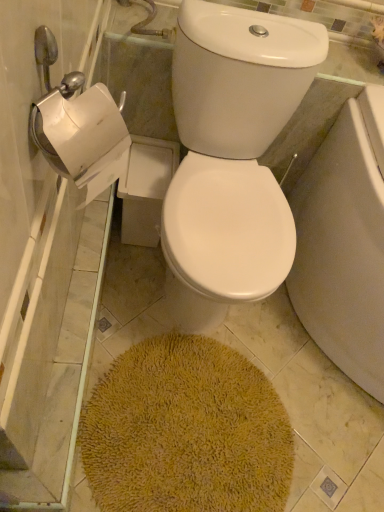
Describe the element at coordinates (186, 431) in the screenshot. I see `yellow shaggy bath mat at center` at that location.

I want to click on yellow shaggy bath mat at center, so click(x=186, y=431).

Find the location of a particular element. This screenshot has height=512, width=384. white glossy toilet bowl at center is located at coordinates (231, 156).

Image resolution: width=384 pixels, height=512 pixels. What do you see at coordinates (231, 156) in the screenshot?
I see `white glossy toilet bowl at center` at bounding box center [231, 156].

At what (x,y) coordinates should I click in order to perform the action: click on yellow shaggy bath mat at center. Please return your answer as a coordinate pair (x, y). The width and height of the screenshot is (384, 512). Looking at the image, I should click on (186, 431).

Based on their positions, is white glossy toilet bowl at center located to the left or right of yellow shaggy bath mat at center?

white glossy toilet bowl at center is to the right of yellow shaggy bath mat at center.

In the image, is white glossy toilet bowl at center positioned in front of or behind yellow shaggy bath mat at center?

In the image, white glossy toilet bowl at center appears in front of yellow shaggy bath mat at center.

Between point (238, 236) and point (116, 384), which one is positioned in front?

The point (238, 236) is closer to the camera.

From the image's perspective, which one is positioned higher, white glossy toilet bowl at center or yellow shaggy bath mat at center?

white glossy toilet bowl at center, from the image's perspective.

From a real-world perspective, which object stands above the other?

white glossy toilet bowl at center.

Looking at this image, can you confirm if white glossy toilet bowl at center is wider than yellow shaggy bath mat at center?

Yes.

Who is shorter, white glossy toilet bowl at center or yellow shaggy bath mat at center?

yellow shaggy bath mat at center.

Based on their sizes in the image, would you say white glossy toilet bowl at center is bigger or smaller than yellow shaggy bath mat at center?

Considering their sizes, white glossy toilet bowl at center takes up more space than yellow shaggy bath mat at center.

Is white glossy toilet bowl at center spatially inside yellow shaggy bath mat at center, or outside of it?

white glossy toilet bowl at center is spatially situated outside yellow shaggy bath mat at center.

Based on the photo, is white glossy toilet bowl at center not close to yellow shaggy bath mat at center?

No, white glossy toilet bowl at center is in close proximity to yellow shaggy bath mat at center.

Is white glossy toilet bowl at center facing towards yellow shaggy bath mat at center?

Yes, white glossy toilet bowl at center is facing yellow shaggy bath mat at center.

Can you tell me how much white glossy toilet bowl at center and yellow shaggy bath mat at center differ in facing direction?

The angular difference between white glossy toilet bowl at center and yellow shaggy bath mat at center is 0.000102 degrees.

Locate an element on the screen. The height and width of the screenshot is (512, 384). toilet bowl in front of the yellow shaggy bath mat at center is located at coordinates (231, 156).

Which object is positioned more to the right, yellow shaggy bath mat at center or white glossy toilet bowl at center?

white glossy toilet bowl at center.

Considering their positions, is yellow shaggy bath mat at center located in front of or behind white glossy toilet bowl at center?

In the image, yellow shaggy bath mat at center appears behind white glossy toilet bowl at center.

Is point (261, 499) closer or farther from the camera than point (271, 174)?

Clearly, point (261, 499) is closer to the camera than point (271, 174).

From the image's perspective, which one is positioned higher, yellow shaggy bath mat at center or white glossy toilet bowl at center?

white glossy toilet bowl at center, from the image's perspective.

From a real-world perspective, is yellow shaggy bath mat at center physically located above or below white glossy toilet bowl at center?

yellow shaggy bath mat at center is situated lower than white glossy toilet bowl at center in the real world.

From the picture: Can you confirm if yellow shaggy bath mat at center is thinner than white glossy toilet bowl at center?

Correct, the width of yellow shaggy bath mat at center is less than that of white glossy toilet bowl at center.

Based on the photo, is yellow shaggy bath mat at center taller or shorter than white glossy toilet bowl at center?

yellow shaggy bath mat at center is shorter than white glossy toilet bowl at center.

Who is bigger, yellow shaggy bath mat at center or white glossy toilet bowl at center?

white glossy toilet bowl at center is bigger.

Could white glossy toilet bowl at center be considered to be inside yellow shaggy bath mat at center?

No, white glossy toilet bowl at center is located outside of yellow shaggy bath mat at center.

Is yellow shaggy bath mat at center in contact with white glossy toilet bowl at center?

yellow shaggy bath mat at center and white glossy toilet bowl at center are not in contact.

Is yellow shaggy bath mat at center turned away from white glossy toilet bowl at center?

Yes, yellow shaggy bath mat at center is positioned with its back facing white glossy toilet bowl at center.

You are a GUI agent. You are given a task and a screenshot of the screen. Output one action in this format:
    pyautogui.click(x=<x>, y=<y>)
    Task: Click on the toilet bowl to the right of yellow shaggy bath mat at center
    The image size is (384, 512).
    Given the screenshot: What is the action you would take?
    pyautogui.click(x=231, y=156)

You are a GUI agent. You are given a task and a screenshot of the screen. Output one action in this format:
    pyautogui.click(x=<x>, y=<y>)
    Task: Click on the bath mat below the white glossy toilet bowl at center (from the image's perspective)
    
    Given the screenshot: What is the action you would take?
    pyautogui.click(x=186, y=431)

The width and height of the screenshot is (384, 512). I want to click on toilet bowl that appears above the yellow shaggy bath mat at center (from the image's perspective), so click(231, 156).